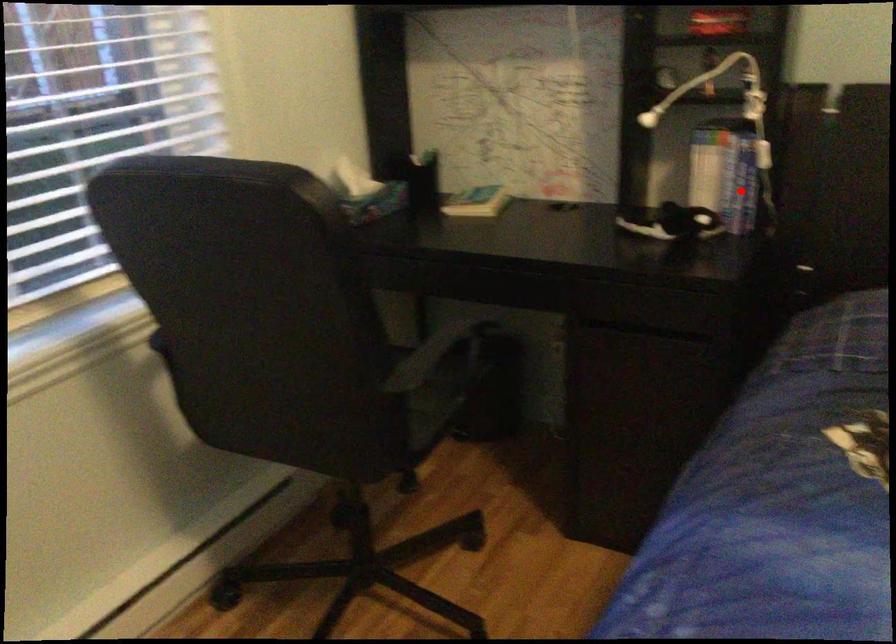
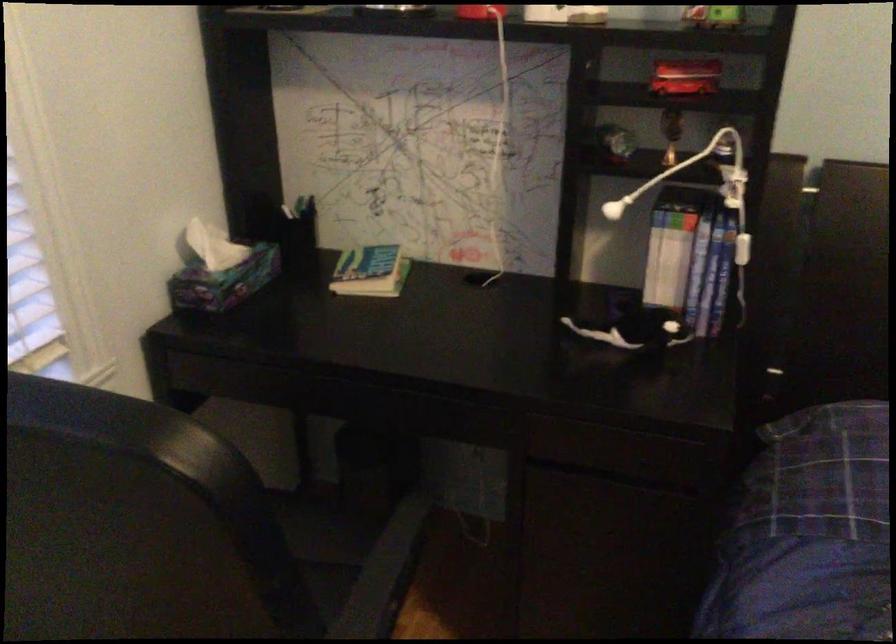
Find the pixel in the second image that matches the highlighted location in the first image.

(707, 288)